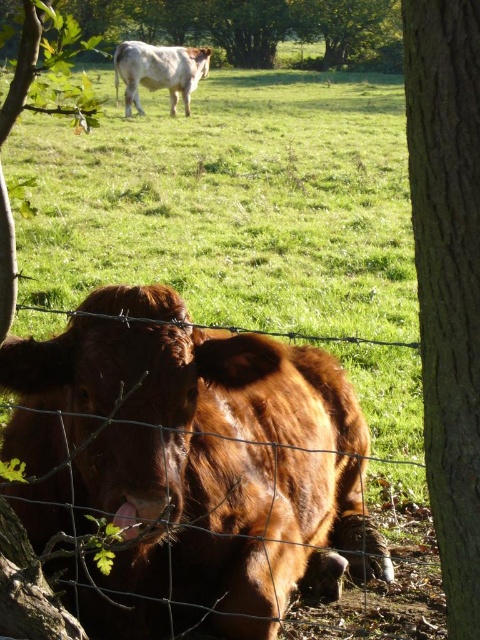
Is point (117, 250) positioned in front of point (129, 42)?

Yes, point (117, 250) is closer to viewer.

Can you confirm if brown furry cow at lower left is thinner than white glossy cow at upper center?

No.

Identify the location of brown furry cow at lower left. (232, 204).

Can you confirm if shiny brown bull at lower left is bigger than green leafy tree at upper center?

No.

Does shiny brown bull at lower left appear over green leafy tree at upper center?

Incorrect, shiny brown bull at lower left is not positioned above green leafy tree at upper center.

Between point (168, 408) and point (233, 48), which one is positioned in front?

Positioned in front is point (168, 408).

The height and width of the screenshot is (640, 480). I want to click on shiny brown bull at lower left, so click(x=188, y=467).

Does smooth brown bark at right appear over white glossy cow at upper center?

No, smooth brown bark at right is not above white glossy cow at upper center.

Between smooth brown bark at right and white glossy cow at upper center, which one appears on the left side from the viewer's perspective?

white glossy cow at upper center

Identify the location of smooth brown bark at right. (447, 278).

Identify the location of smooth brown bark at right. The height and width of the screenshot is (640, 480). (447, 278).